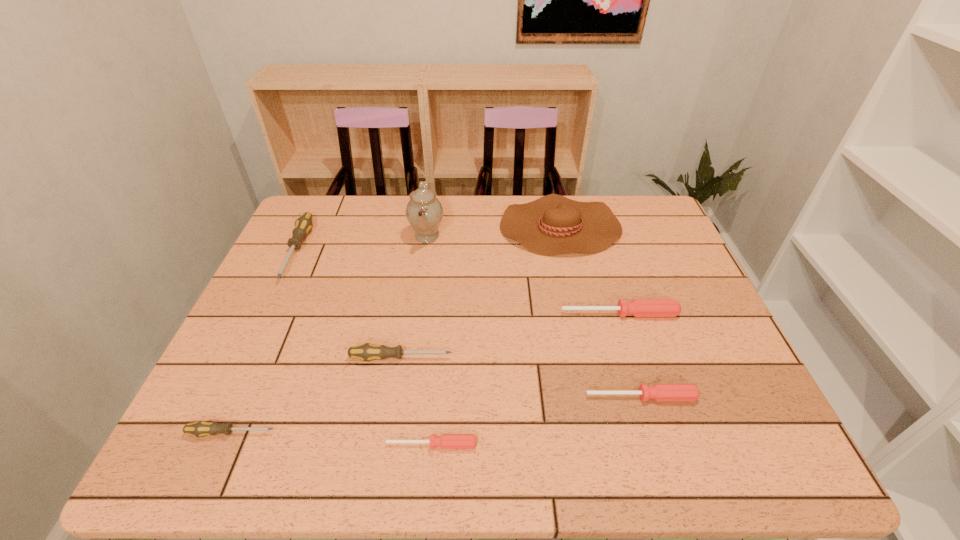
Locate an element on the screen. red screwdriver that stands as the second closest to the nearest gray screwdriver is located at coordinates (659, 392).

Identify the location of free space that satisfies the following two spatial constraints: 1. on the back side of the shortest object; 2. on the right side of the biggest red screwdriver. (443, 314).

Where is `free location that satisfies the following two spatial constraints: 1. at the tip of the smallest gray screwdriver; 2. on the back side of the leftmost red screwdriver`? free location that satisfies the following two spatial constraints: 1. at the tip of the smallest gray screwdriver; 2. on the back side of the leftmost red screwdriver is located at coordinates (227, 444).

Where is `vacant space that satisfies the following two spatial constraints: 1. at the tip of the third farthest screwdriver; 2. on the right side of the sixth farthest object`? The height and width of the screenshot is (540, 960). vacant space that satisfies the following two spatial constraints: 1. at the tip of the third farthest screwdriver; 2. on the right side of the sixth farthest object is located at coordinates (395, 397).

The image size is (960, 540). Find the location of `free spot that satisfies the following two spatial constraints: 1. at the tip of the farthest red screwdriver; 2. on the left side of the farthest screwdriver`. free spot that satisfies the following two spatial constraints: 1. at the tip of the farthest red screwdriver; 2. on the left side of the farthest screwdriver is located at coordinates (267, 314).

Identify the location of blank space that satisfies the following two spatial constraints: 1. at the tip of the second farthest screwdriver; 2. on the left side of the third tallest object. (267, 314).

The width and height of the screenshot is (960, 540). I want to click on free location that satisfies the following two spatial constraints: 1. at the tip of the sixth shortest object; 2. on the right side of the fifth nearest screwdriver, so click(267, 314).